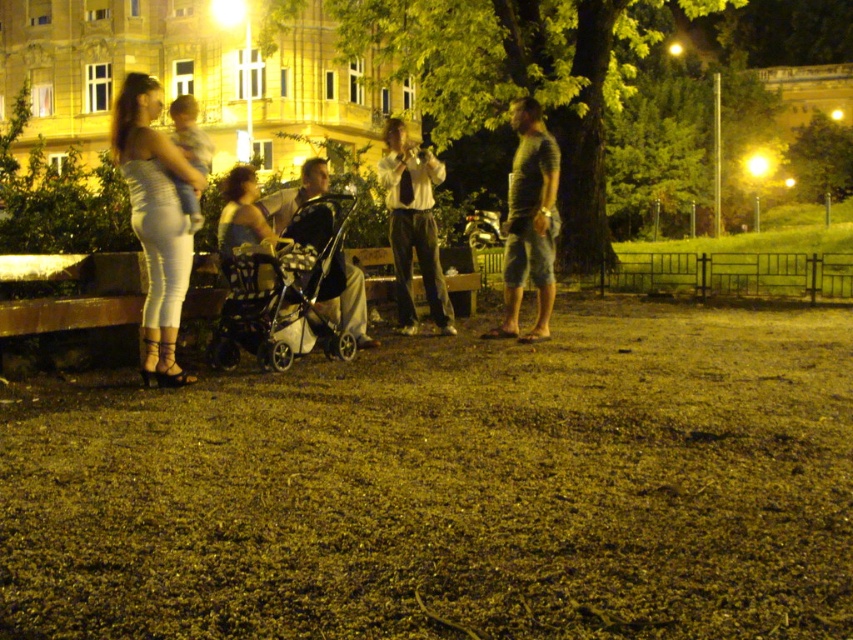
Is matte black stroller at center shorter than matte white pants at left?

Incorrect, matte black stroller at center's height does not fall short of matte white pants at left's.

Is point (161, 332) behind point (138, 134)?

Yes, it is.

Image resolution: width=853 pixels, height=640 pixels. What are the coordinates of `matte black stroller at center` in the screenshot? It's located at (157, 218).

Looking at this image, who is positioned more to the left, matte white pants at left or white shirt at center?

matte white pants at left

Is matte white pants at left further to camera compared to white shirt at center?

No.

This screenshot has height=640, width=853. What do you see at coordinates (155, 220) in the screenshot?
I see `matte white pants at left` at bounding box center [155, 220].

Where is `matte white pants at left`? matte white pants at left is located at coordinates (155, 220).

Which is behind, point (167, 211) or point (405, 202)?

The point (405, 202) is more distant.

Between matte black stroller at center and white shirt at center, which one has less height?

white shirt at center

Locate an element on the screen. This screenshot has height=640, width=853. matte black stroller at center is located at coordinates (x=157, y=218).